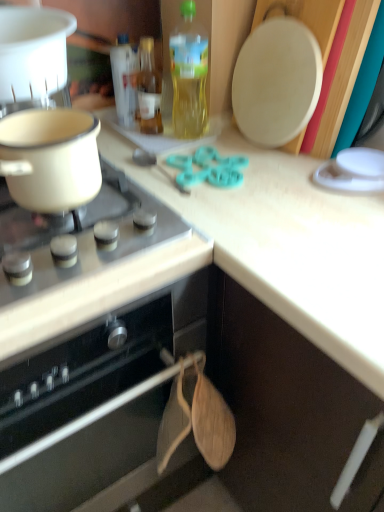
At what (x,y) coordinates should I click in order to perform the action: click on free spot to the right of translucent plastic bottle at upper center, positioned as the third bottle in right-to-left order. Please return your answer as a coordinate pair (x, y). The width and height of the screenshot is (384, 512). Looking at the image, I should click on (174, 127).